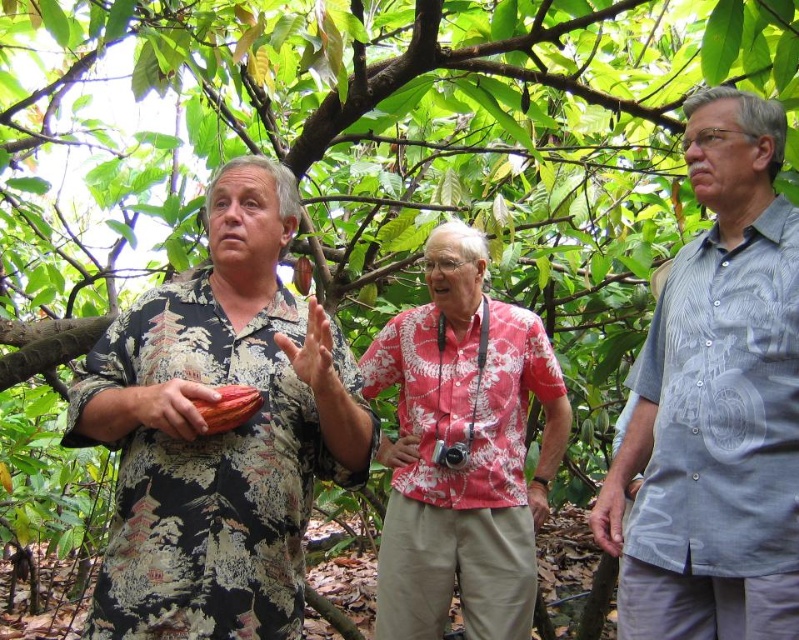
Can you confirm if light blue printed shirt at right is thinner than red floral shirt at center?

Yes, light blue printed shirt at right is thinner than red floral shirt at center.

Can you confirm if light blue printed shirt at right is positioned to the left of red floral shirt at center?

In fact, light blue printed shirt at right is to the right of red floral shirt at center.

Who is more distant from viewer, (720,93) or (495,400)?

The point (495,400) is behind.

You are a GUI agent. You are given a task and a screenshot of the screen. Output one action in this format:
    pyautogui.click(x=<x>, y=<y>)
    Task: Click on the light blue printed shirt at right
    
    Given the screenshot: What is the action you would take?
    pyautogui.click(x=716, y=403)

Who is more distant from viewer, (336, 333) or (714, 275)?

Point (714, 275)

Does brown floral shirt at center appear on the left side of light blue printed shirt at right?

Correct, you'll find brown floral shirt at center to the left of light blue printed shirt at right.

From the picture: Who is more forward, [249,259] or [722,166]?

Point [249,259] is more forward.

Identify the location of brown floral shirt at center. point(219,433).

Is point (268, 584) closer to viewer compared to point (380, 374)?

Yes, it is.

Does brown floral shirt at center have a lesser width compared to red floral shirt at center?

Correct, brown floral shirt at center's width is less than red floral shirt at center's.

Find the location of a particular element. The width and height of the screenshot is (799, 640). brown floral shirt at center is located at coordinates (219, 433).